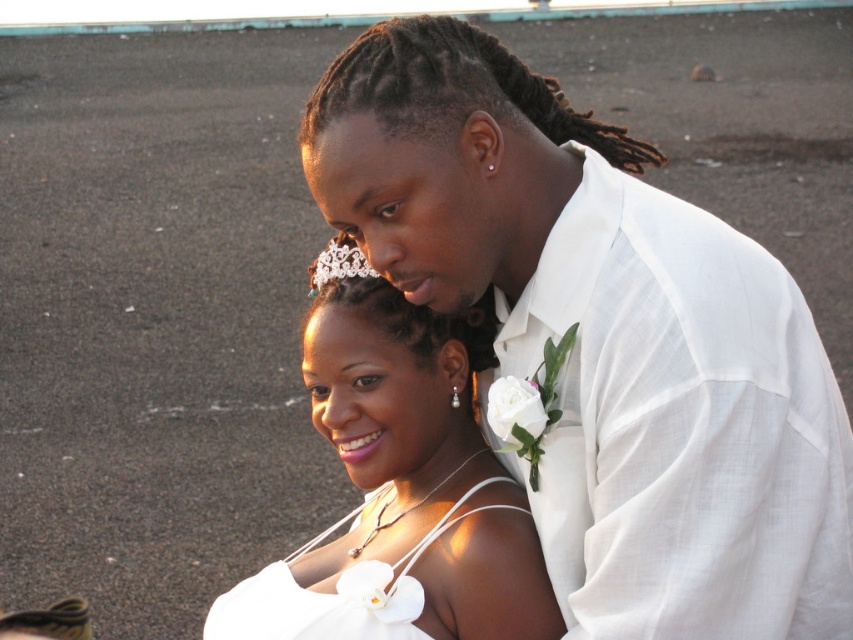
Is point (235, 602) positioned after point (352, 253)?

That is True.

Is white satin dress at lower center wider than pearl/textured tiara at upper center?

No, white satin dress at lower center is not wider than pearl/textured tiara at upper center.

Which is in front, point (349, 588) or point (311, 294)?

Positioned in front is point (349, 588).

Identify the location of white satin dress at lower center. The height and width of the screenshot is (640, 853). (335, 593).

Find the location of a particular element. The height and width of the screenshot is (640, 853). white satin dress at center is located at coordinates (401, 490).

Measure the distance from white satin dress at center to pearl/textured tiara at upper center.

white satin dress at center and pearl/textured tiara at upper center are 29.74 inches apart from each other.

Does point (415, 536) come behind point (334, 280)?

No, it is in front of (334, 280).

You are a GUI agent. You are given a task and a screenshot of the screen. Output one action in this format:
    pyautogui.click(x=<x>, y=<y>)
    Task: Click on the white satin dress at center
    
    Given the screenshot: What is the action you would take?
    pyautogui.click(x=401, y=490)

Does point (389, 588) lie behind point (245, 620)?

No.

Which is behind, point (465, 625) or point (366, 496)?

The point (366, 496) is behind.

At what (x,y) coordinates should I click in order to perform the action: click on white satin dress at center. Please return your answer as a coordinate pair (x, y). Looking at the image, I should click on (401, 490).

Where is `white satin dress at center`? This screenshot has width=853, height=640. white satin dress at center is located at coordinates (401, 490).